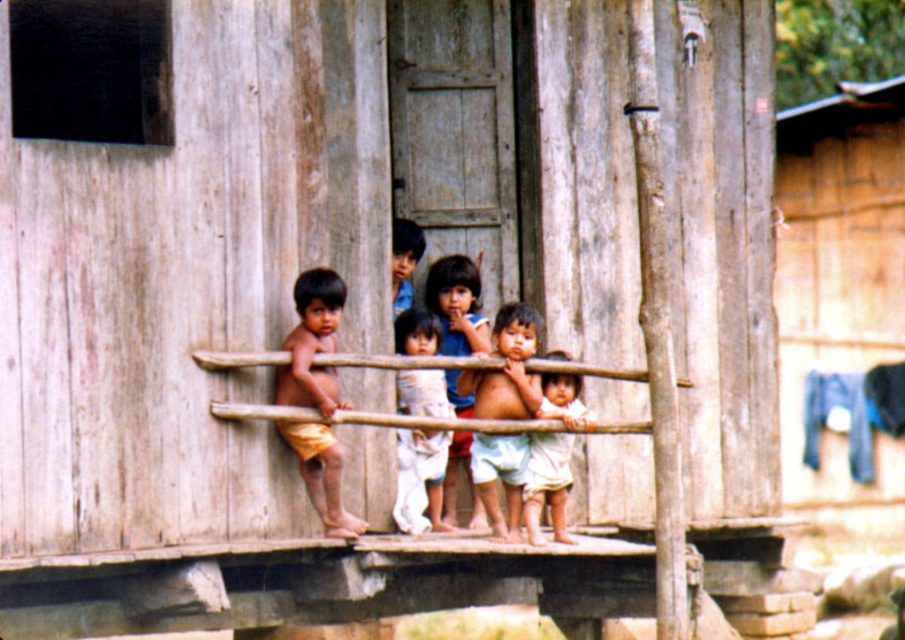
The image size is (905, 640). What do you see at coordinates (839, 285) in the screenshot? I see `wooden clothesline at right` at bounding box center [839, 285].

Measure the distance from wooden clothesline at right to smooth skin child at center.

They are 86.73 feet apart.

Which is in front, point (854, 131) or point (444, 483)?

Point (444, 483) is in front.

Locate an element on the screen. wooden clothesline at right is located at coordinates (839, 285).

Can you confirm if wooden clothesline at right is positioned to the left of brown skin/soft skin boy at center?

Incorrect, wooden clothesline at right is not on the left side of brown skin/soft skin boy at center.

Can you confirm if wooden clothesline at right is bigger than brown skin/soft skin boy at center?

Yes.

Who is more forward, (820, 272) or (337, 492)?

Positioned in front is point (337, 492).

At what (x,y) coordinates should I click in order to perform the action: click on wooden clothesline at right. Please return your answer as a coordinate pair (x, y). This screenshot has height=640, width=905. Looking at the image, I should click on (839, 285).

In the scene shown: Is brown skin/soft skin boy at center taller than light beige cotton shirt at center?

Yes.

Between point (319, 449) and point (557, 477), which one is positioned behind?

The point (557, 477) is more distant.

Between point (311, 342) and point (532, 474), which one is positioned behind?

The point (532, 474) is behind.

You are a GUI agent. You are given a task and a screenshot of the screen. Output one action in this format:
    pyautogui.click(x=<x>, y=<y>)
    Task: Click on the brown skin/soft skin boy at center
    Image resolution: width=905 pixels, height=640 pixels.
    Given the screenshot: What is the action you would take?
    pyautogui.click(x=312, y=342)